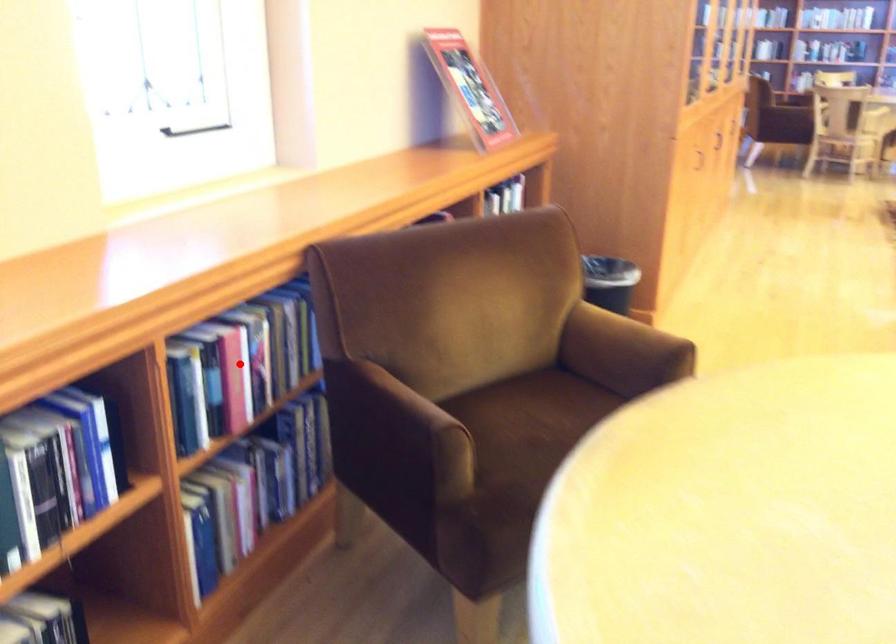
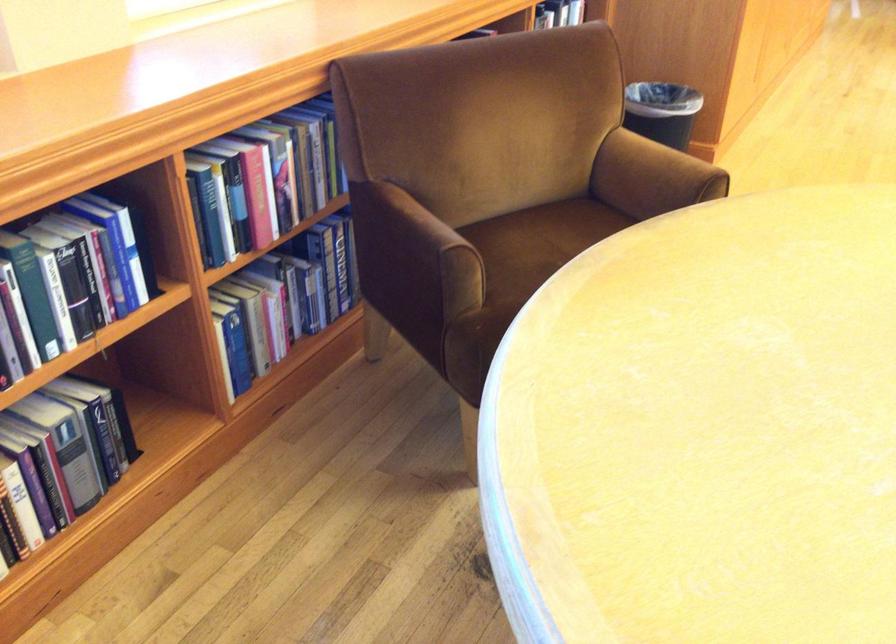
Where in the second image is the point corresponding to the highlighted location from the first image?

(263, 178)